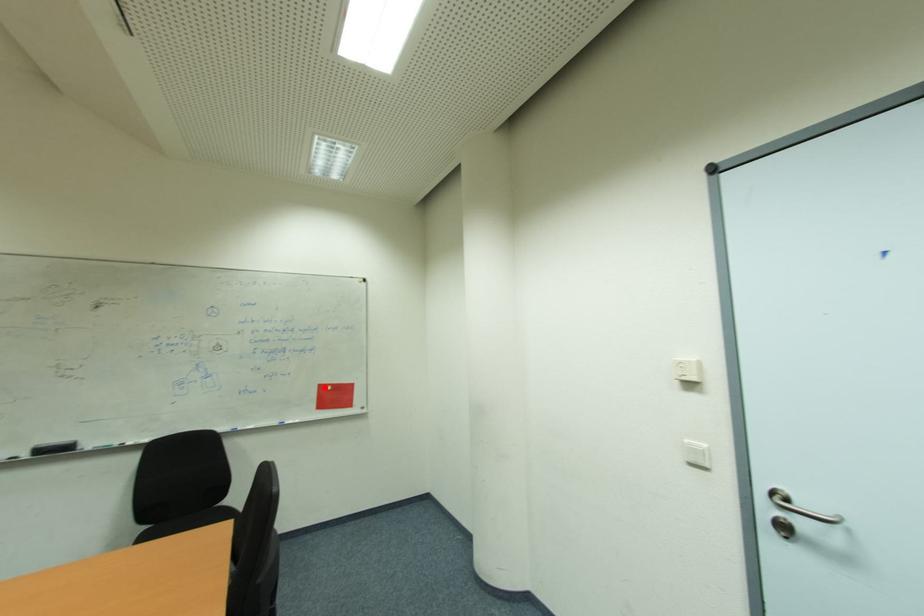
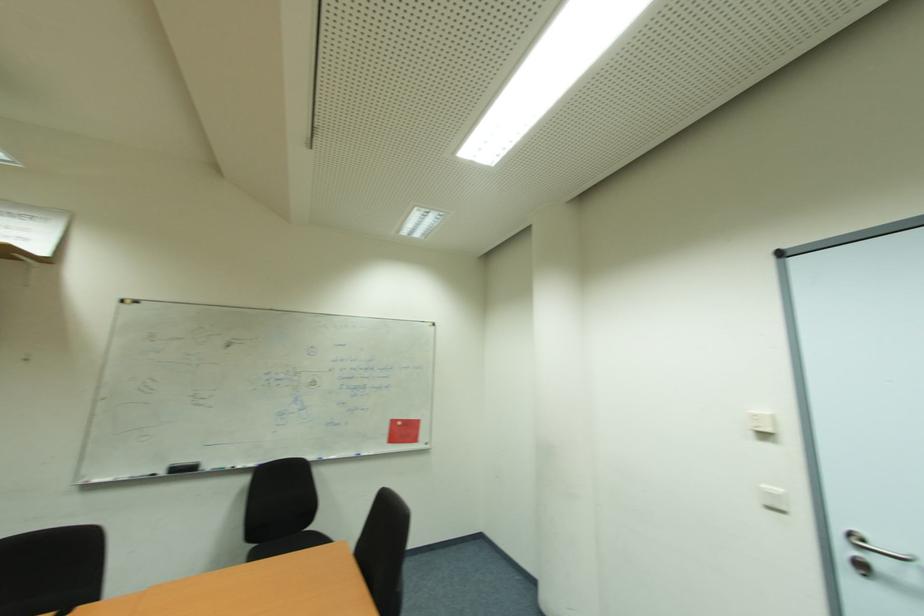
Locate, in the second image, the point that corresponds to the highlighted location in the first image.

(397, 423)